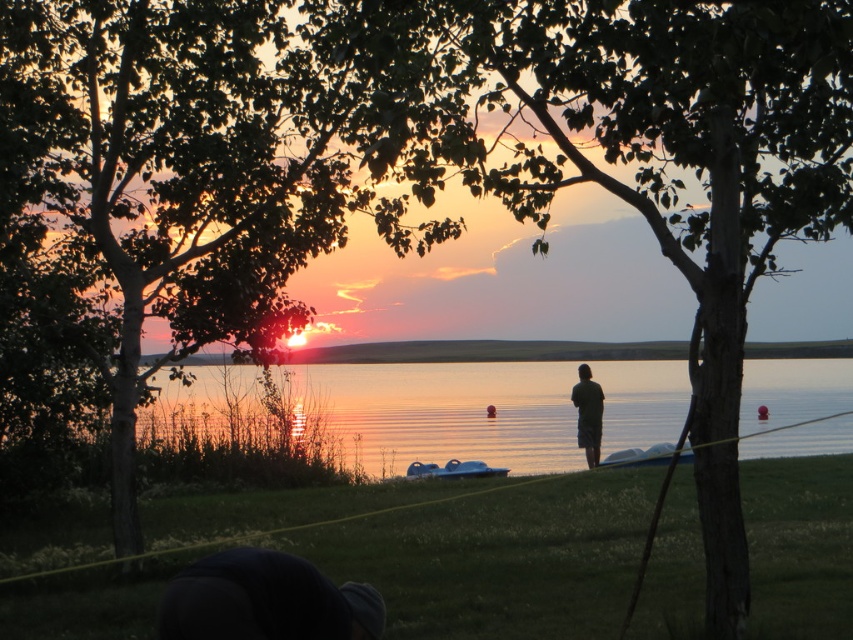
Based on the scene description, where is the green leafy tree at center located in the image?

The green leafy tree at center is located at point (619,156).

You are standing at the water edge and want to take a photo of the green leafy tree at center. If your camera has a maximum zoom range of 5 meters, will you need to zoom in to capture the tree in full frame?

The green leafy tree at center is 7.24 meters away from the camera. Since the maximum zoom range is 5 meters, you will need to zoom in beyond the camera capabilities to capture the tree in full frame.

You are standing at point (445, 468) and want to walk to the water edge. Is there an obstacle between you and point (585, 392)?

Point (585, 392) is behind point (445, 468), so there is an obstacle between you and the water edge.